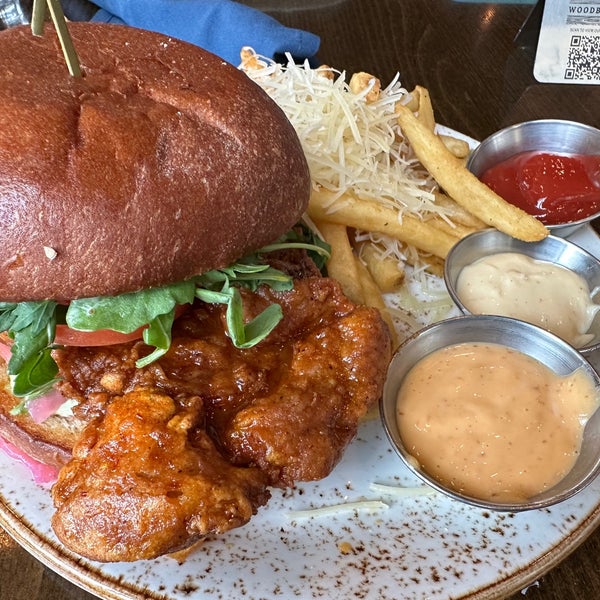
The height and width of the screenshot is (600, 600). Identify the location of plate. (362, 465).